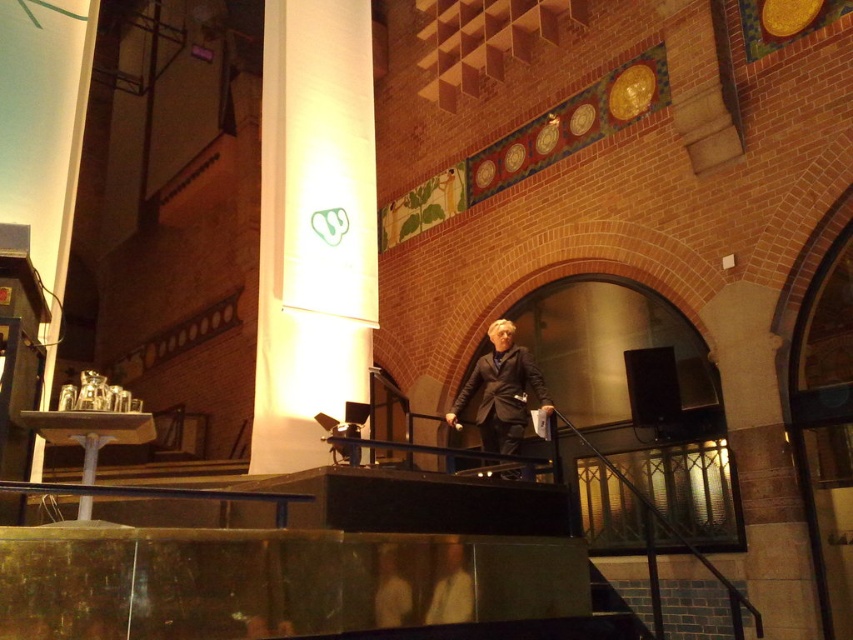
You are an event organizer setting up a stage for a presentation. You have a white paper at center and a light brown leather jacket at center on the platform. Which item takes up more space on the platform?

The white paper at center is bigger than the light brown leather jacket at center, so it takes up more space on the platform.

You are an architect examining the interior of a historic building. You notice two points marked on the wall. The first point is at coordinates point (293, 428) and the second is at point (395, 620). Which point is closer to you?

Point (293, 428) is closer to you because it is further to the viewer than point (395, 620).